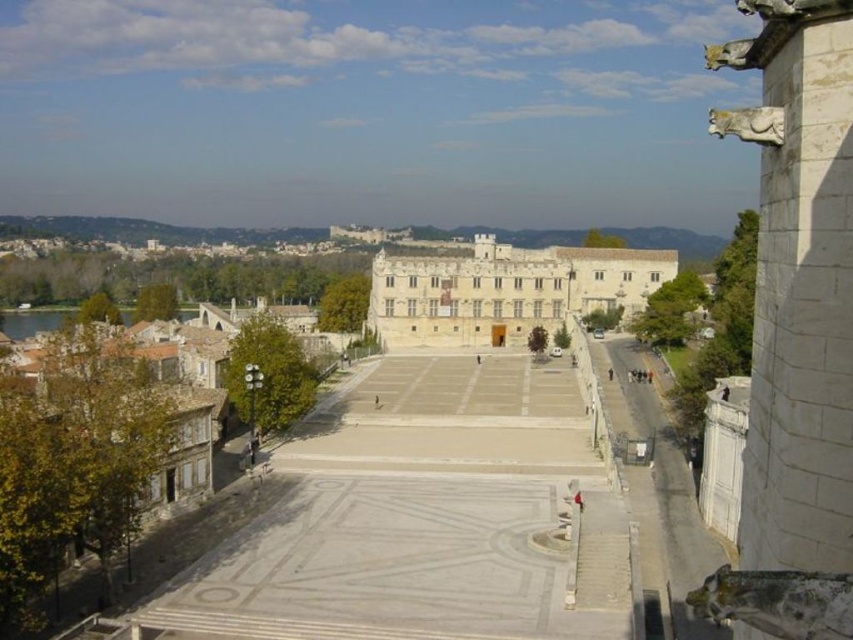
Question: Which point is farther to the camera?

Choices:
 (A) white stone gargoyle at right
 (B) white stone palace at center

Answer: (B)

Question: Does white stone gargoyle at right appear under white stone palace at center?

Choices:
 (A) yes
 (B) no

Answer: (A)

Question: Can you confirm if white stone gargoyle at right is thinner than white stone palace at center?

Choices:
 (A) yes
 (B) no

Answer: (A)

Question: Which point appears closest to the camera in this image?

Choices:
 (A) (508, 310)
 (B) (848, 145)

Answer: (B)

Question: In this image, where is white stone gargoyle at right located relative to white stone palace at center?

Choices:
 (A) below
 (B) above

Answer: (A)